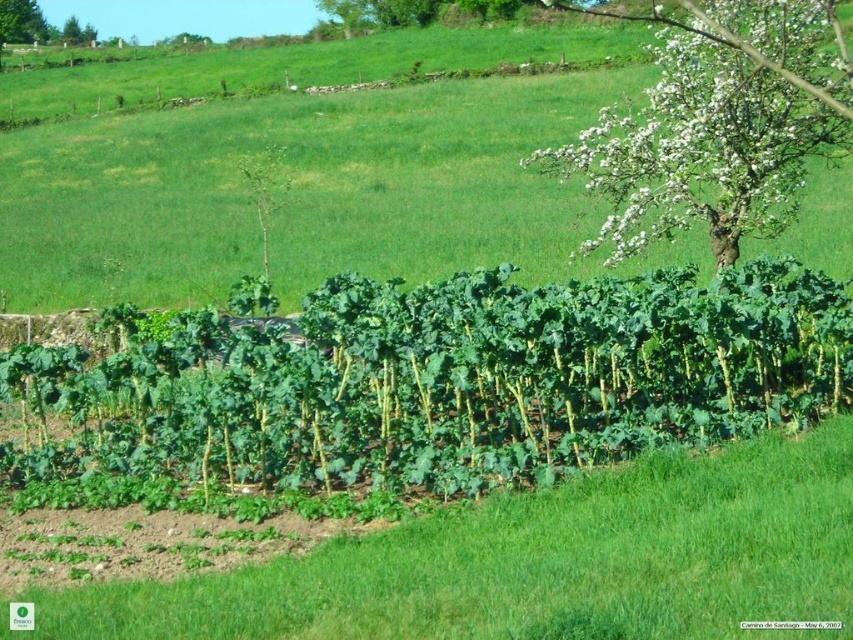
Question: Which of the following is the closest to the observer?

Choices:
 (A) green leafy plant at center
 (B) green leafy plant at upper left
 (C) white blossoming tree at upper right

Answer: (C)

Question: Is green leafy plant at center wider than white blossoming tree at upper right?

Choices:
 (A) no
 (B) yes

Answer: (A)

Question: Does white blossoming tree at upper right have a greater width compared to green leafy plant at upper left?

Choices:
 (A) yes
 (B) no

Answer: (A)

Question: Which point is closer to the camera?

Choices:
 (A) click(16, 1)
 (B) click(761, 77)
 (C) click(25, 349)

Answer: (C)

Question: Does white blossoming tree at upper right appear under green leafy plant at upper left?

Choices:
 (A) no
 (B) yes

Answer: (B)

Question: Which point is closer to the camera taking this photo?

Choices:
 (A) (19, 28)
 (B) (705, 84)
 (C) (834, 348)

Answer: (C)